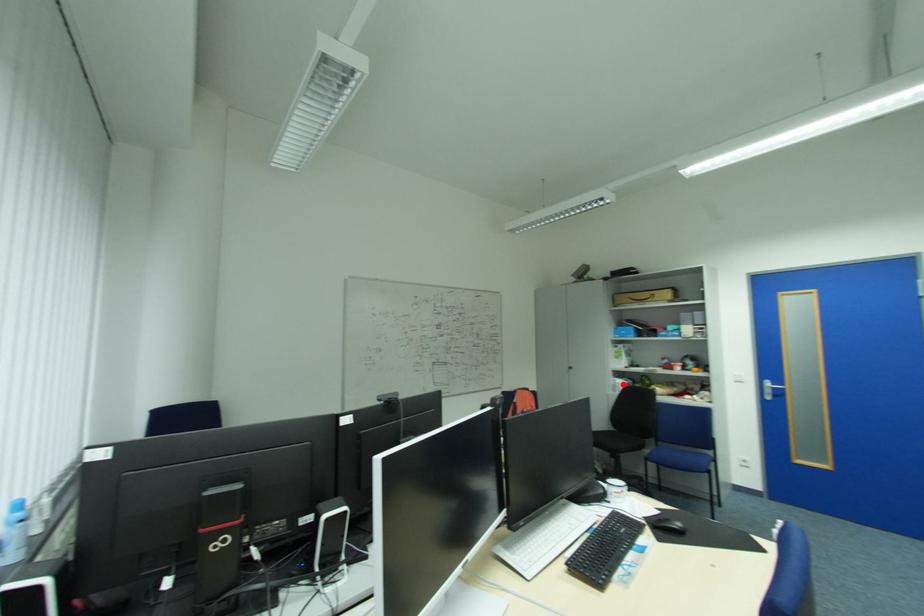
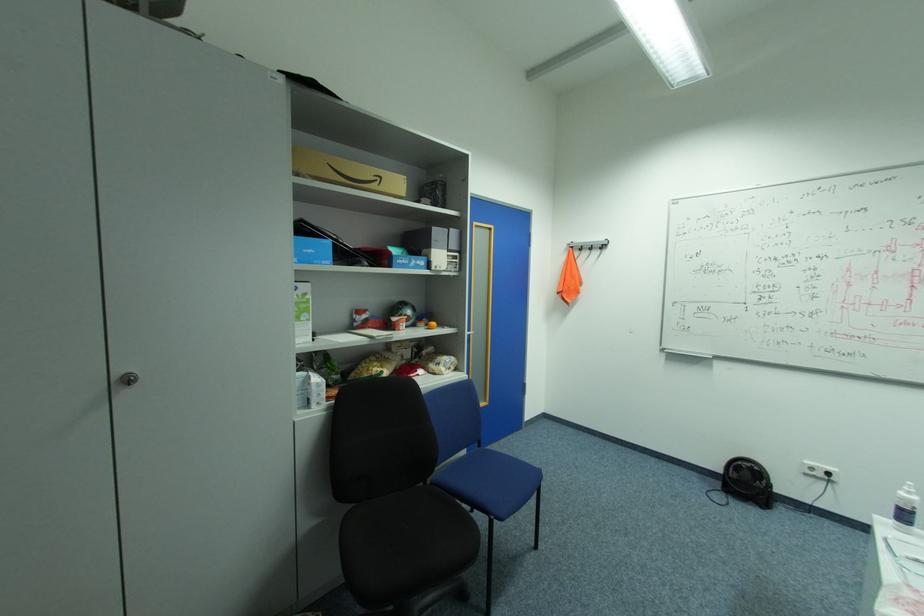
The point at the highlighted location is marked in the first image. Where is the corresponding point in the second image?

(321, 387)